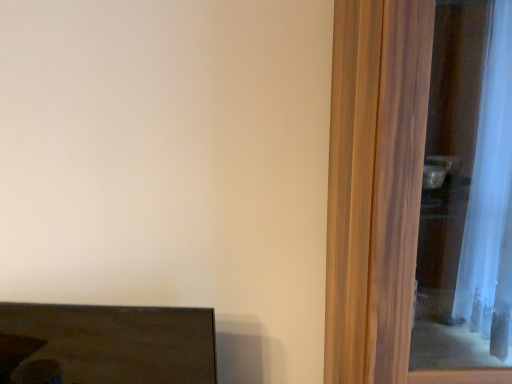
Question: Can you confirm if matte dark brown coffee table at lower left is bigger than transparent glass screen door at right?

Choices:
 (A) no
 (B) yes

Answer: (A)

Question: Considering the relative positions of matte dark brown coffee table at lower left and transparent glass screen door at right in the image provided, is matte dark brown coffee table at lower left to the left of transparent glass screen door at right from the viewer's perspective?

Choices:
 (A) no
 (B) yes

Answer: (B)

Question: Does matte dark brown coffee table at lower left appear on the right side of transparent glass screen door at right?

Choices:
 (A) yes
 (B) no

Answer: (B)

Question: Is matte dark brown coffee table at lower left taller than transparent glass screen door at right?

Choices:
 (A) no
 (B) yes

Answer: (A)

Question: Is matte dark brown coffee table at lower left smaller than transparent glass screen door at right?

Choices:
 (A) no
 (B) yes

Answer: (B)

Question: Is matte dark brown coffee table at lower left far from transparent glass screen door at right?

Choices:
 (A) yes
 (B) no

Answer: (B)

Question: Is the position of transparent glass screen door at right more distant than that of matte dark brown coffee table at lower left?

Choices:
 (A) no
 (B) yes

Answer: (A)

Question: From the image's perspective, is transparent glass screen door at right above matte dark brown coffee table at lower left?

Choices:
 (A) no
 (B) yes

Answer: (B)

Question: Considering the relative positions of transparent glass screen door at right and matte dark brown coffee table at lower left in the image provided, is transparent glass screen door at right in front of matte dark brown coffee table at lower left?

Choices:
 (A) no
 (B) yes

Answer: (B)

Question: Can you confirm if transparent glass screen door at right is taller than matte dark brown coffee table at lower left?

Choices:
 (A) no
 (B) yes

Answer: (B)

Question: Considering the relative positions of transparent glass screen door at right and matte dark brown coffee table at lower left in the image provided, is transparent glass screen door at right to the left of matte dark brown coffee table at lower left from the viewer's perspective?

Choices:
 (A) no
 (B) yes

Answer: (A)

Question: Are transparent glass screen door at right and matte dark brown coffee table at lower left located far from each other?

Choices:
 (A) no
 (B) yes

Answer: (A)

Question: Looking at the image, does transparent glass screen door at right seem bigger or smaller compared to matte dark brown coffee table at lower left?

Choices:
 (A) small
 (B) big

Answer: (B)